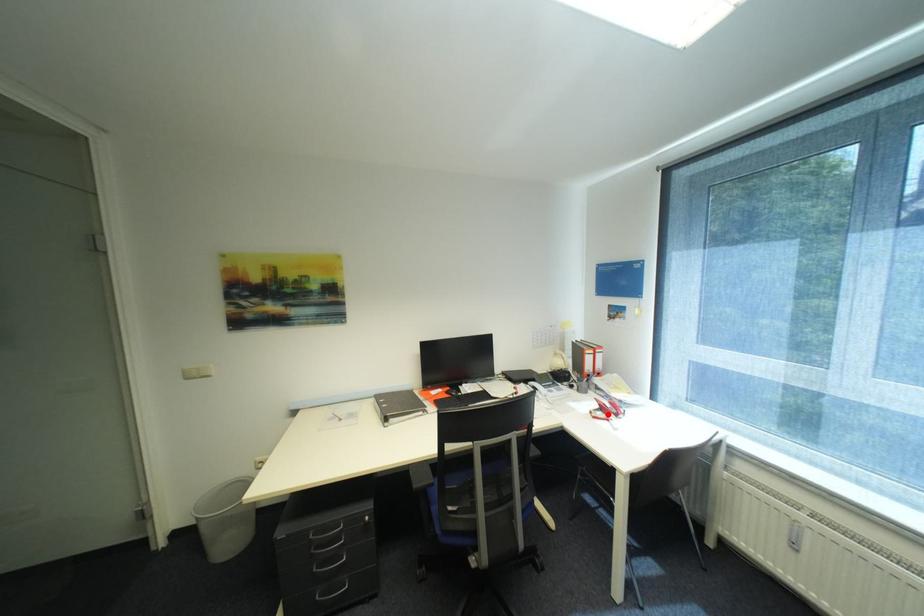
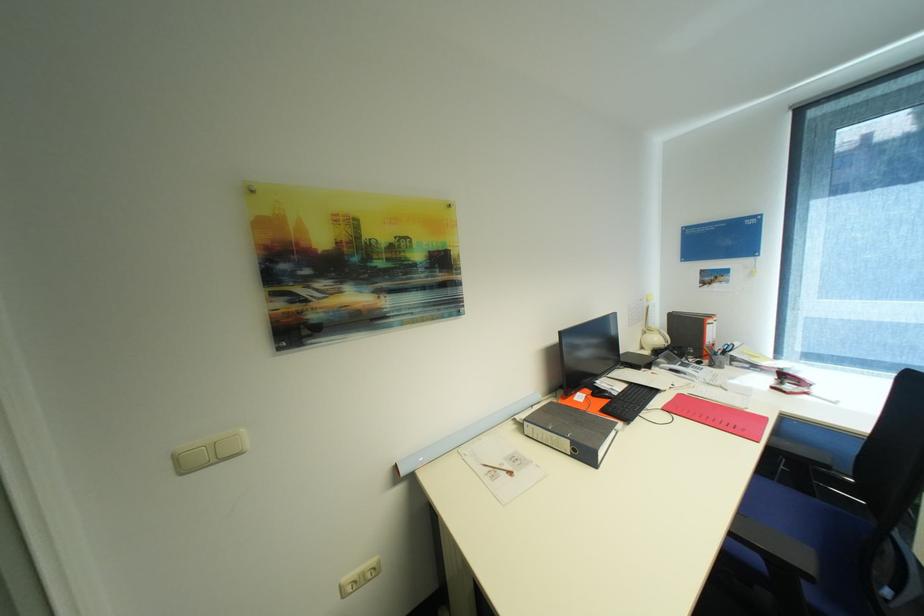
In the second image, find the point that corresponds to the highlighted location in the first image.

(796, 387)